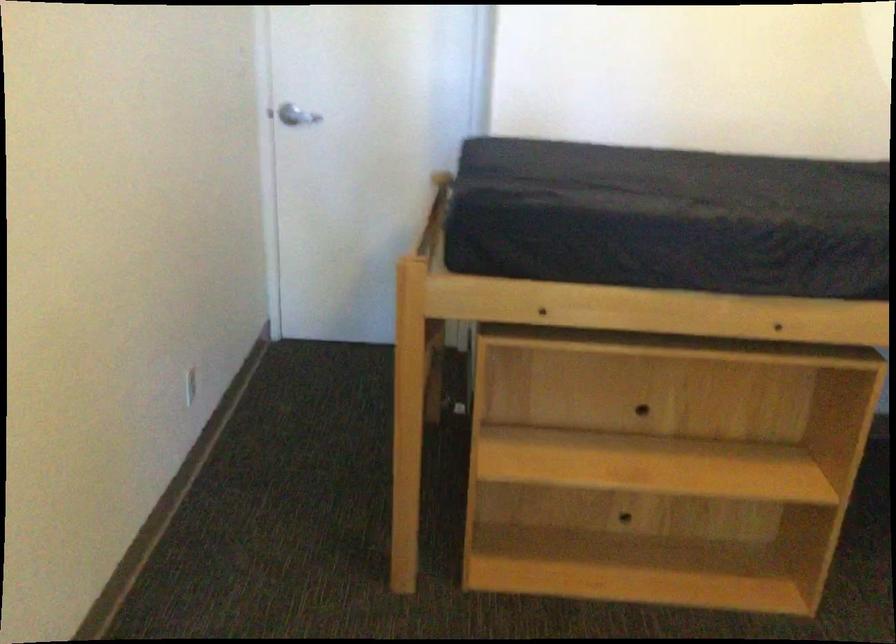
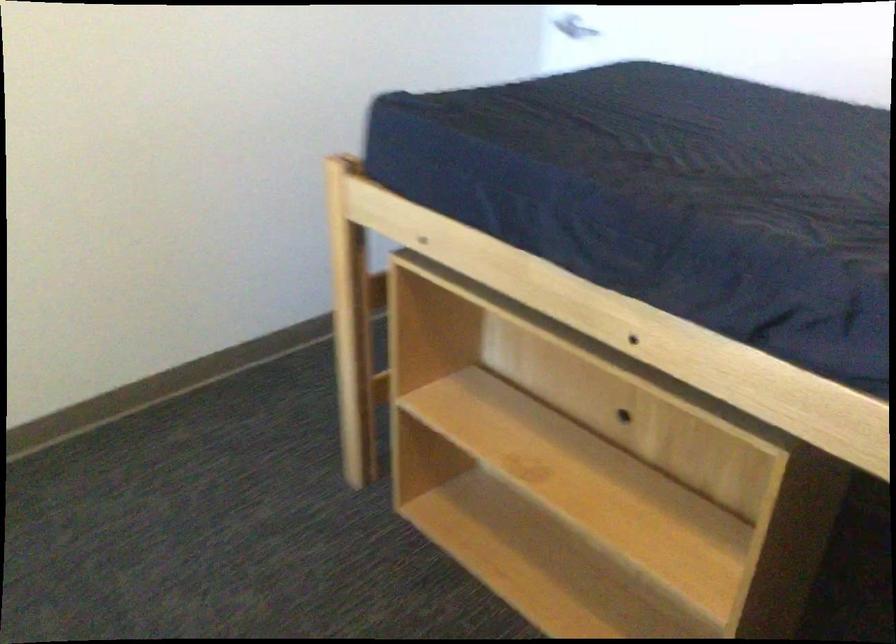
Find the pixel in the second image that matches point 763,218 in the first image.

(651, 193)